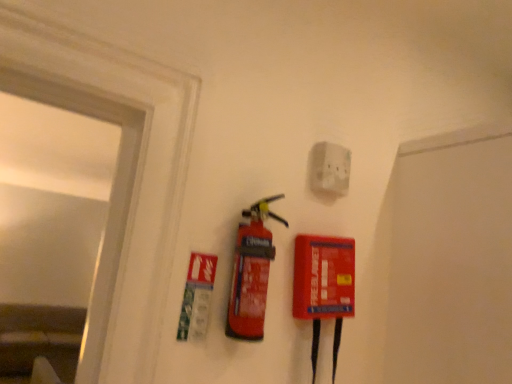
What do you see at coordinates (251, 273) in the screenshot?
I see `red matte fire extinguisher at center` at bounding box center [251, 273].

You are a GUI agent. You are given a task and a screenshot of the screen. Output one action in this format:
    pyautogui.click(x=<x>, y=<y>)
    Task: Click on the red matte fire extinguisher at center
    
    Given the screenshot: What is the action you would take?
    pyautogui.click(x=251, y=273)

Locate an element on the screen. Image resolution: width=512 pixels, height=384 pixels. white matte electric outlet at upper center is located at coordinates (330, 168).

The image size is (512, 384). What do you see at coordinates (330, 168) in the screenshot? I see `white matte electric outlet at upper center` at bounding box center [330, 168].

Locate an element on the screen. This screenshot has height=384, width=512. red matte fire extinguisher at center is located at coordinates (251, 273).

In the image, is white matte electric outlet at upper center on the left side or the right side of red matte fire extinguisher at center?

white matte electric outlet at upper center is positioned on red matte fire extinguisher at center's right side.

Is the position of white matte electric outlet at upper center more distant than that of red matte fire extinguisher at center?

Yes, white matte electric outlet at upper center is behind red matte fire extinguisher at center.

Is point (322, 179) farther from viewer compared to point (238, 261)?

Yes, point (322, 179) is behind point (238, 261).

From the image's perspective, does white matte electric outlet at upper center appear higher than red matte fire extinguisher at center?

Yes, from the image's perspective, white matte electric outlet at upper center is on top of red matte fire extinguisher at center.

From a real-world perspective, which object stands above the other?

white matte electric outlet at upper center, from a real-world perspective.

Considering the sizes of objects white matte electric outlet at upper center and red matte fire extinguisher at center in the image provided, who is wider, white matte electric outlet at upper center or red matte fire extinguisher at center?

red matte fire extinguisher at center.

Does white matte electric outlet at upper center have a greater height compared to red matte fire extinguisher at center?

In fact, white matte electric outlet at upper center may be shorter than red matte fire extinguisher at center.

Considering the sizes of objects white matte electric outlet at upper center and red matte fire extinguisher at center in the image provided, who is bigger, white matte electric outlet at upper center or red matte fire extinguisher at center?

With larger size is red matte fire extinguisher at center.

Would you say white matte electric outlet at upper center contains red matte fire extinguisher at center?

No, red matte fire extinguisher at center is not inside white matte electric outlet at upper center.

Is white matte electric outlet at upper center directly adjacent to red matte fire extinguisher at center?

They are not placed beside each other.

Is white matte electric outlet at upper center facing away from red matte fire extinguisher at center?

white matte electric outlet at upper center is not turned away from red matte fire extinguisher at center.

How different are the orientations of white matte electric outlet at upper center and red matte fire extinguisher at center in degrees?

The facing directions of white matte electric outlet at upper center and red matte fire extinguisher at center are 1.39 degrees apart.

Measure the distance from white matte electric outlet at upper center to red matte fire extinguisher at center.

white matte electric outlet at upper center is 10.50 inches away from red matte fire extinguisher at center.

What are the coordinates of `fire extinguisher in front of the white matte electric outlet at upper center` in the screenshot? It's located at (251, 273).

Looking at this image, is red matte fire extinguisher at center at the right side of white matte electric outlet at upper center?

No.

Does red matte fire extinguisher at center come behind white matte electric outlet at upper center?

No, red matte fire extinguisher at center is closer to the camera.

Does point (245, 295) appear closer or farther from the camera than point (326, 166)?

Point (245, 295).

From the image's perspective, does red matte fire extinguisher at center appear higher than white matte electric outlet at upper center?

No, from the image's perspective, red matte fire extinguisher at center is not on top of white matte electric outlet at upper center.

From a real-world perspective, relative to white matte electric outlet at upper center, is red matte fire extinguisher at center vertically above or below?

From a real-world perspective, red matte fire extinguisher at center is physically below white matte electric outlet at upper center.

Does red matte fire extinguisher at center have a lesser width compared to white matte electric outlet at upper center?

No, red matte fire extinguisher at center is not thinner than white matte electric outlet at upper center.

Can you confirm if red matte fire extinguisher at center is shorter than white matte electric outlet at upper center?

No.

In terms of size, does red matte fire extinguisher at center appear bigger or smaller than white matte electric outlet at upper center?

red matte fire extinguisher at center is bigger than white matte electric outlet at upper center.

Is red matte fire extinguisher at center positioned beyond the bounds of white matte electric outlet at upper center?

Yes.

Is there a large distance between red matte fire extinguisher at center and white matte electric outlet at upper center?

No, red matte fire extinguisher at center is not far away from white matte electric outlet at upper center.

Does red matte fire extinguisher at center turn towards white matte electric outlet at upper center?

No, red matte fire extinguisher at center is not oriented towards white matte electric outlet at upper center.

How many degrees apart are the facing directions of red matte fire extinguisher at center and white matte electric outlet at upper center?

red matte fire extinguisher at center and white matte electric outlet at upper center are facing 1.39 degrees away from each other.

You are a GUI agent. You are given a task and a screenshot of the screen. Output one action in this format:
    pyautogui.click(x=<x>, y=<y>)
    Task: Click on the electric outlet above the red matte fire extinguisher at center (from the image's perspective)
    This screenshot has height=384, width=512.
    Given the screenshot: What is the action you would take?
    pyautogui.click(x=330, y=168)

There is a red matte fire extinguisher at center. Identify the location of electric outlet above it (from a real-world perspective). (330, 168).

You are a GUI agent. You are given a task and a screenshot of the screen. Output one action in this format:
    pyautogui.click(x=<x>, y=<y>)
    Task: Click on the electric outlet lying on the right of red matte fire extinguisher at center
    This screenshot has height=384, width=512.
    Given the screenshot: What is the action you would take?
    pyautogui.click(x=330, y=168)